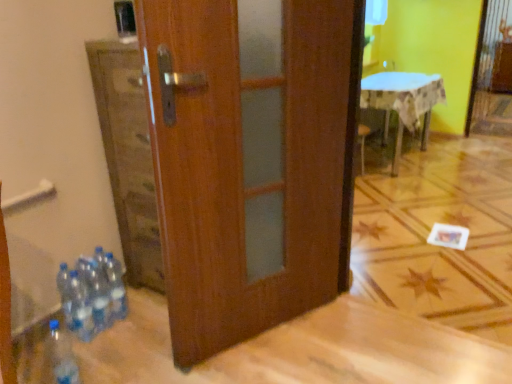
You are a GUI agent. You are given a task and a screenshot of the screen. Output one action in this format:
    pyautogui.click(x=<x>, y=<y>)
    Task: Click on the vacant area that is situated to the right of clear plastic bottles at lower left, positioned as the 3th bottle in front-to-back order
    This screenshot has height=384, width=512.
    Given the screenshot: What is the action you would take?
    pyautogui.click(x=138, y=325)